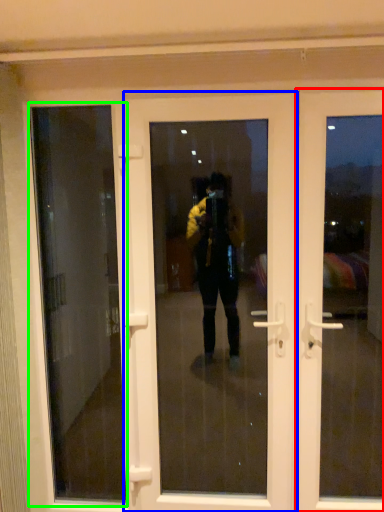
Question: Estimate the real-world distances between objects in this image. Which object is closer to door (highlighted by a red box), door (highlighted by a blue box) or window screen (highlighted by a green box)?

Choices:
 (A) door
 (B) window screen

Answer: (A)